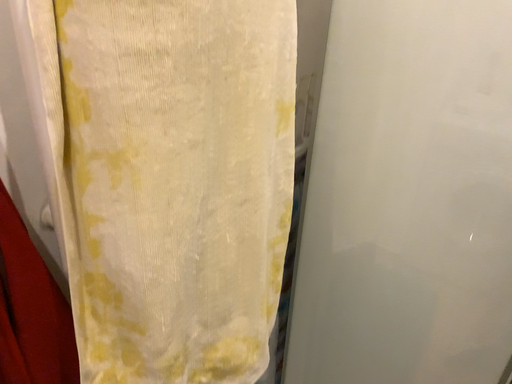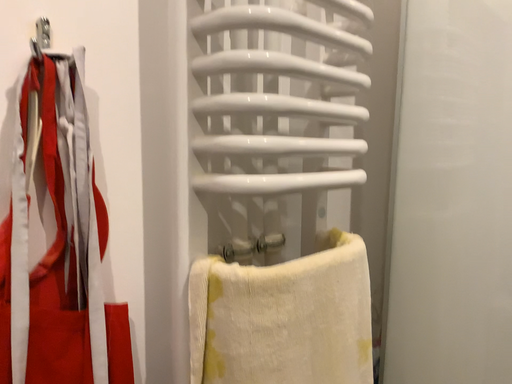
Question: How did the camera likely rotate when shooting the video?

Choices:
 (A) rotated downward
 (B) rotated upward

Answer: (B)